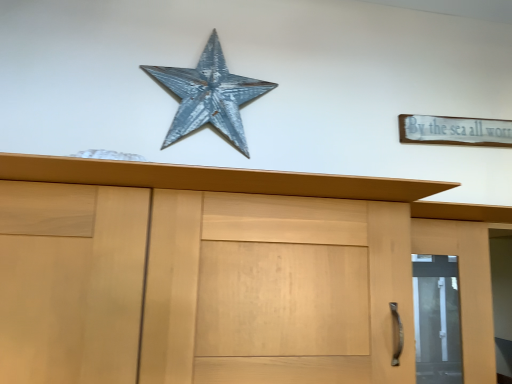
Where is `free point above rusty metal star at upper center (from a real-world perspective)`? Image resolution: width=512 pixels, height=384 pixels. free point above rusty metal star at upper center (from a real-world perspective) is located at coordinates (214, 25).